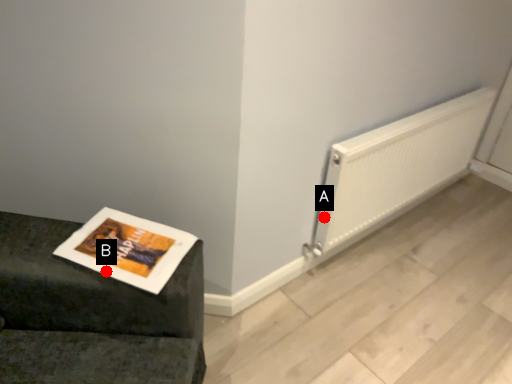
Question: Two points are circled on the image, labeled by A and B beside each circle. Which point is closer to the camera?

Choices:
 (A) A is closer
 (B) B is closer

Answer: (B)